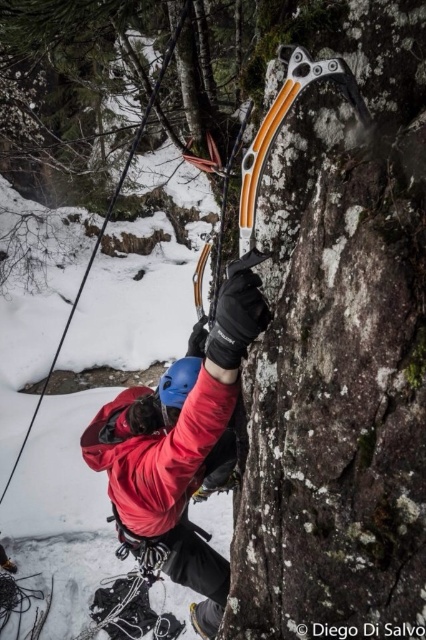
Based on the scene description, which object is wider, the matte red jacket at center or the orange plastic ice axe at upper center?

The matte red jacket at center is wider than the orange plastic ice axe at upper center according to the description.

You are a photographer aiming to capture the climber in the image. You want to ensure both the matte red jacket at center and the orange plastic ice axe at upper center are clearly visible in your frame. Given their relative positions, which object should you focus on first to ensure both are in focus?

The matte red jacket at center is much taller than the orange plastic ice axe at upper center, so focusing on the taller object first would help ensure both are in focus.

Looking at this image, you are a photographer trying to capture the climber in the image. The climber is wearing a matte red jacket at center. If you want to focus on the climber, which object should you center your camera on?

You should center your camera on the matte red jacket at center, as it is located at point (181, 440) and is the climber wearing it.